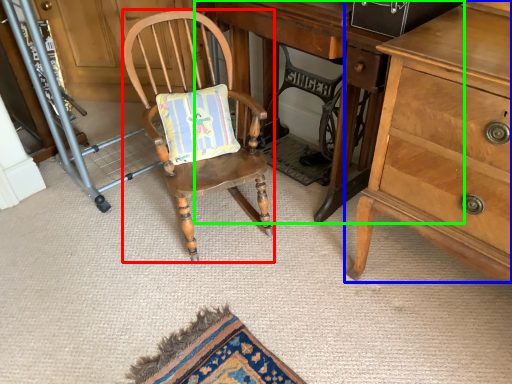
Question: Estimate the real-world distances between objects in this image. Which object is closer to chair (highlighted by a red box), chest of drawers (highlighted by a blue box) or desk (highlighted by a green box)?

Choices:
 (A) chest of drawers
 (B) desk

Answer: (B)